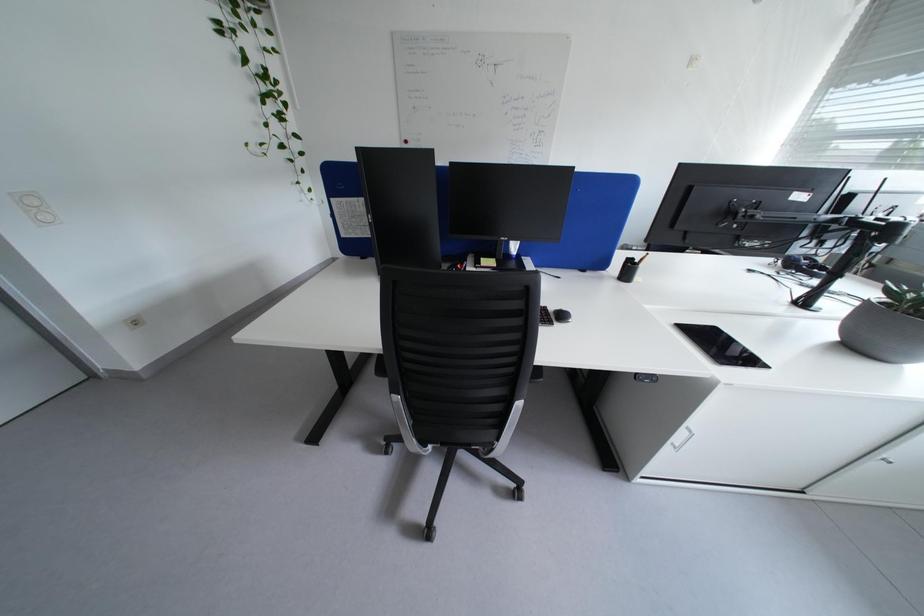
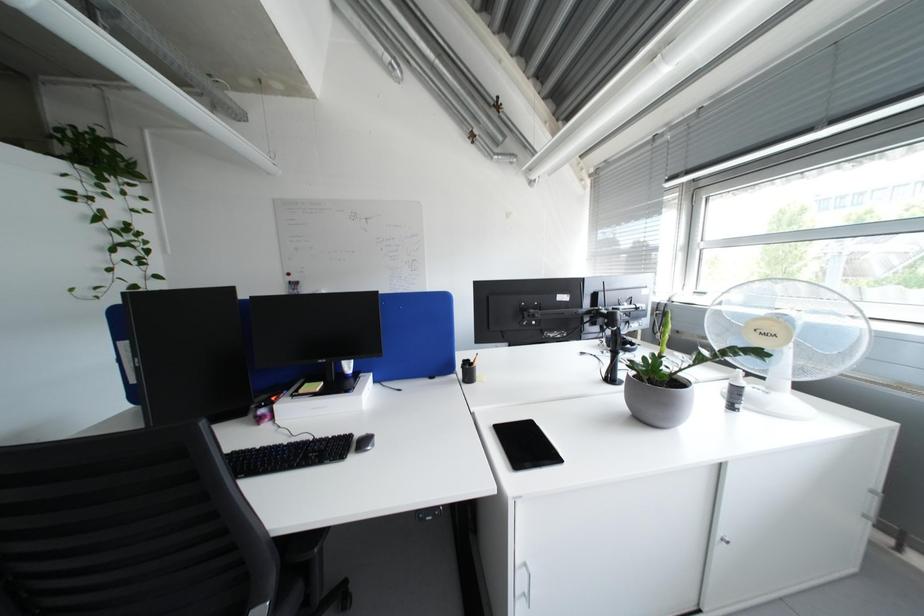
Question: Which direction would the cameraman need to move to produce the second image? Reply with the corresponding letter.

Choices:
 (A) Left
 (B) Right
 (C) Forward
 (D) Backward

Answer: (B)